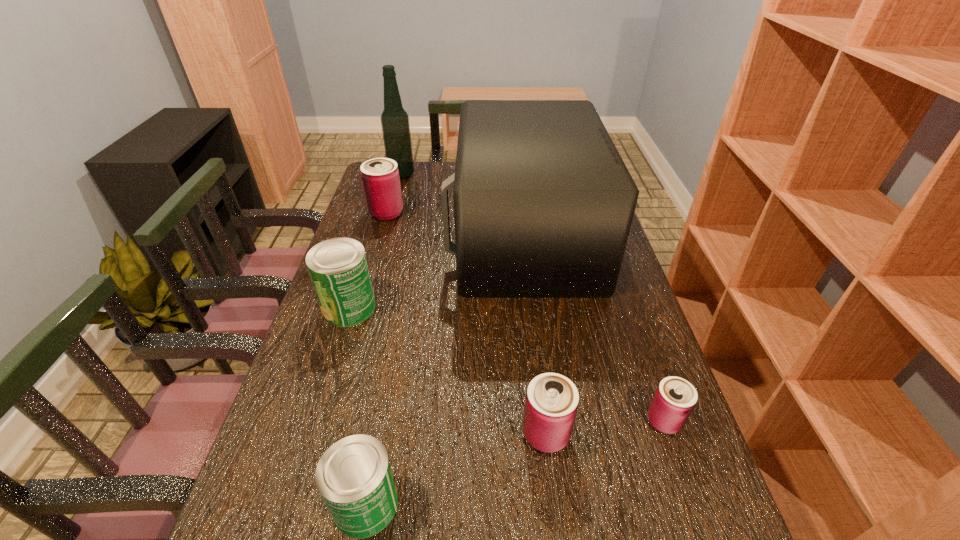
Select which can is the fourth closest to the shortest object. Please provide its 2D coordinates. Your answer should be formatted as a tuple, i.e. [(x, y)], where the tuple contains the x and y coordinates of a point satisfying the conditions above.

[(380, 177)]

Identify which can is the closest to the second tallest object. Please provide its 2D coordinates. Your answer should be formatted as a tuple, i.e. [(x, y)], where the tuple contains the x and y coordinates of a point satisfying the conditions above.

[(380, 177)]

Select which pink can appears as the third closest to the green alcohol. Please provide its 2D coordinates. Your answer should be formatted as a tuple, i.e. [(x, y)], where the tuple contains the x and y coordinates of a point satisfying the conditions above.

[(675, 398)]

The image size is (960, 540). In order to click on pink can that is the closest one to the second smallest pink can in this screenshot , I will do `click(675, 398)`.

Choose which green can is the second nearest neighbor to the rightmost can. Please provide its 2D coordinates. Your answer should be formatted as a tuple, i.e. [(x, y)], where the tuple contains the x and y coordinates of a point satisfying the conditions above.

[(338, 268)]

Identify which green can is the second closest to the farthest pink can. Please provide its 2D coordinates. Your answer should be formatted as a tuple, i.e. [(x, y)], where the tuple contains the x and y coordinates of a point satisfying the conditions above.

[(354, 477)]

This screenshot has width=960, height=540. I want to click on free space that satisfies the following two spatial constraints: 1. on the front side of the second biggest pink can; 2. on the left side of the leftmost pink can, so (x=322, y=434).

The width and height of the screenshot is (960, 540). Identify the location of vacant point that satisfies the following two spatial constraints: 1. on the back side of the tallest object; 2. on the left side of the biggest pink can. (397, 174).